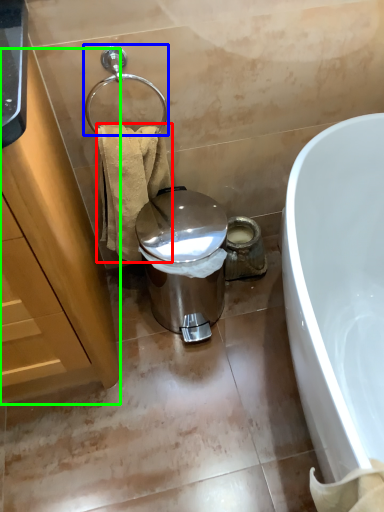
Question: Considering the real-world distances, which object is farthest from towel/napkin (highlighted by a red box)? shower (highlighted by a blue box) or cabinetry (highlighted by a green box)?

Choices:
 (A) shower
 (B) cabinetry

Answer: (B)